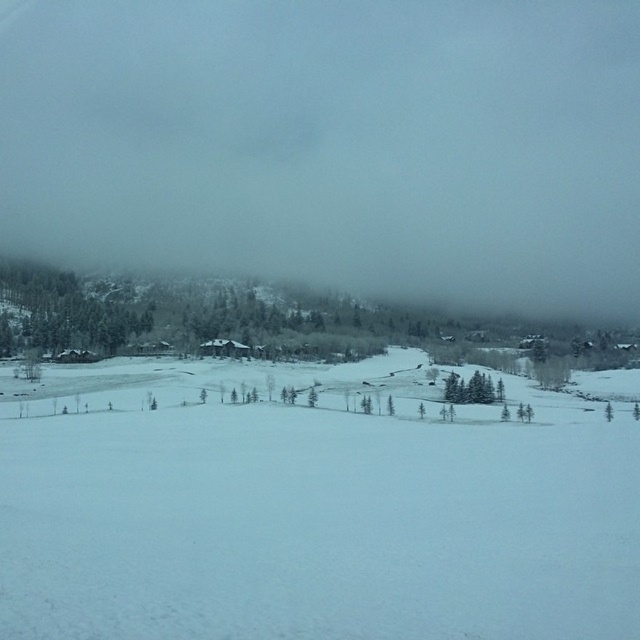
Question: Which object appears closest to the camera in this image?

Choices:
 (A) white fog at upper center
 (B) white snow ski slope at center

Answer: (B)

Question: Which object is closer to the camera taking this photo?

Choices:
 (A) white snow ski slope at center
 (B) white fog at upper center

Answer: (A)

Question: Can you confirm if white fog at upper center is smaller than white snow ski slope at center?

Choices:
 (A) no
 (B) yes

Answer: (A)

Question: Among these objects, which one is nearest to the camera?

Choices:
 (A) white snow ski slope at center
 (B) white fog at upper center

Answer: (A)

Question: Is white fog at upper center wider than white snow ski slope at center?

Choices:
 (A) yes
 (B) no

Answer: (A)

Question: Is white fog at upper center to the right of white snow ski slope at center from the viewer's perspective?

Choices:
 (A) no
 (B) yes

Answer: (A)